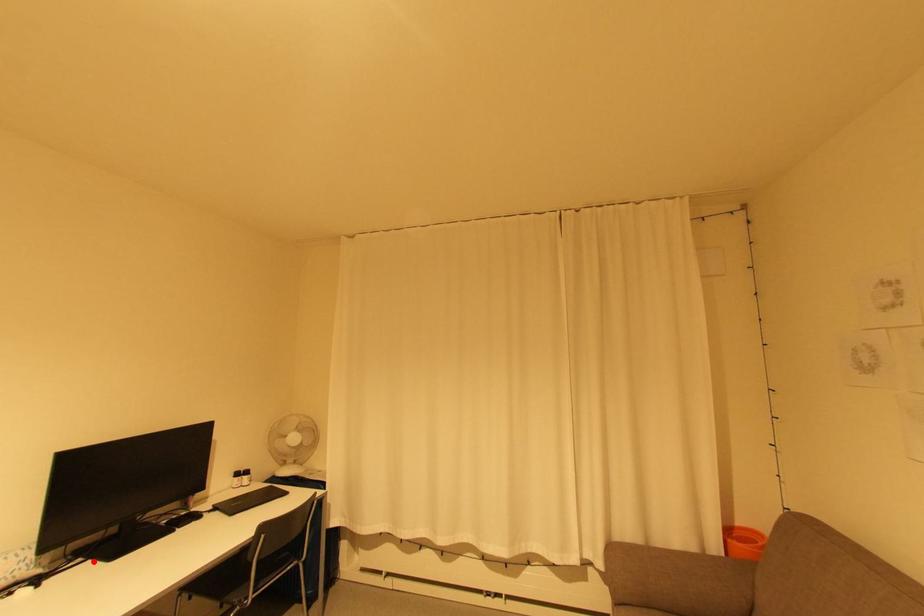
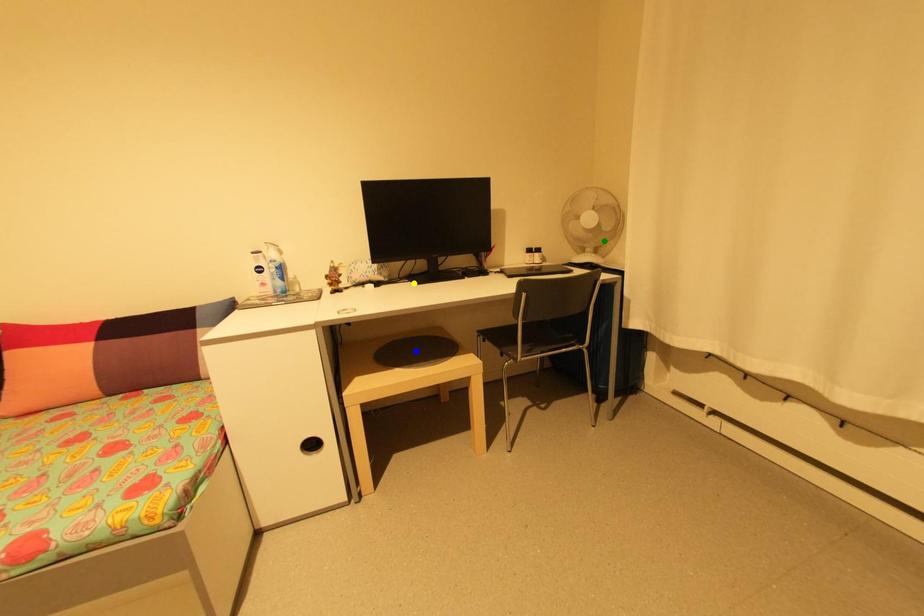
Question: I am providing you with two images of the same scene from different viewpoints. A red point is marked on the first image. You are given multiple points on the second image. In image 2, which mark is for the same physical point as the one in image 1?

Choices:
 (A) yellow point
 (B) green point
 (C) blue point

Answer: (A)